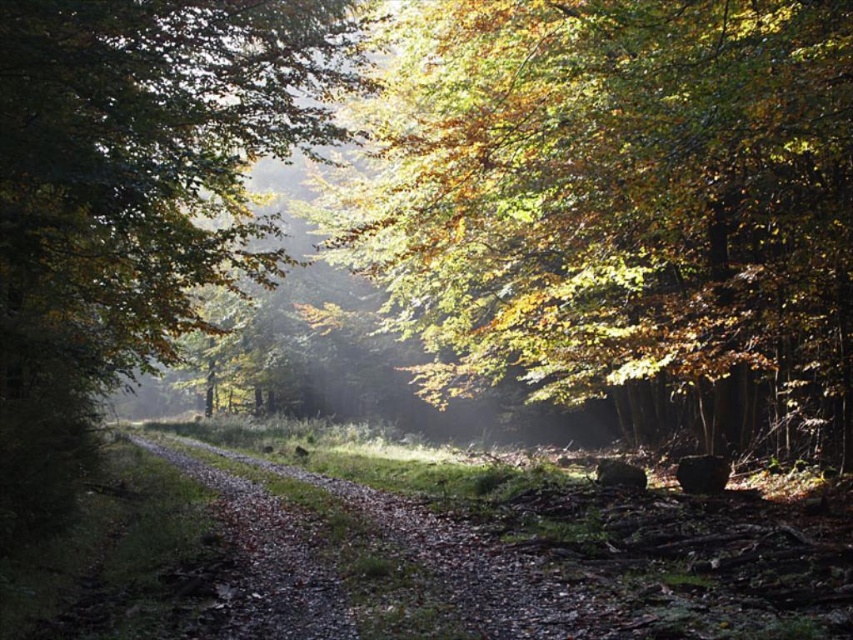
Between point (445, 122) and point (283, 17), which one is positioned behind?

The point (283, 17) is behind.

You are a GUI agent. You are given a task and a screenshot of the screen. Output one action in this format:
    pyautogui.click(x=<x>, y=<y>)
    Task: Click on the golden leafy tree at center
    
    Given the screenshot: What is the action you would take?
    pyautogui.click(x=614, y=196)

Does point (421, 70) lie behind point (94, 268)?

Yes.

Locate an element on the screen. The height and width of the screenshot is (640, 853). golden leafy tree at center is located at coordinates (614, 196).